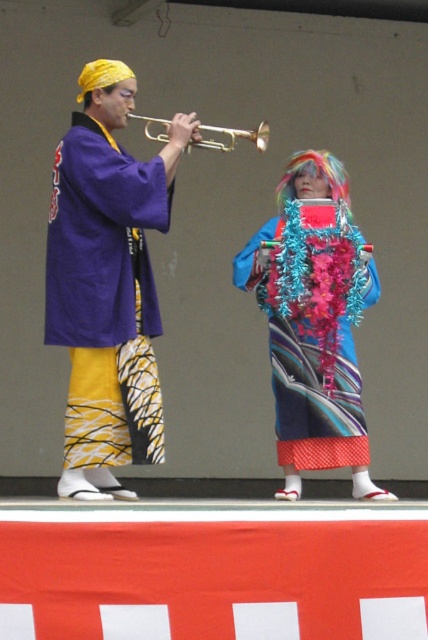
You are a stagehand who needs to place a 3.5 feet wide decorative panel between the purple silk kimono at left and the brass trumpet at center. Is there enough space between them to fit the panel?

The purple silk kimono at left is 6.81 feet from the brass trumpet at center. Since the decorative panel is 3.5 feet wide, there is sufficient space to place it between them as 6.81 feet is greater than 3.5 feet.

You are a stagehand setting up a spotlight. The spotlight can only illuminate objects taller than 1.5 meters. Based on the scene, will the purple silk kimono at left and the brass trumpet at center both be illuminated by the spotlight?

The purple silk kimono at left is taller than the brass trumpet at center. Since the spotlight requires objects to be taller than 1.5 meters, we need to determine their actual heights. However, the description only states their relative height comparison. Without specific height measurements, we cannot confirm if both are above 1.5 meters. Therefore, it is uncertain if both will be illuminated.

Based on the photo, you are an audience member sitting in the front row of the stage. You want to take a photo of both the purple silk kimono at left and the shiny blue kimono at center. Which kimono should you focus on first to ensure both are in the frame?

The purple silk kimono at left is closer to the viewer than the shiny blue kimono at center. To ensure both are in focus, you should focus on the shiny blue kimono at center first, as it is farther away and adjusting focus there will help include the closer object in the depth of field.